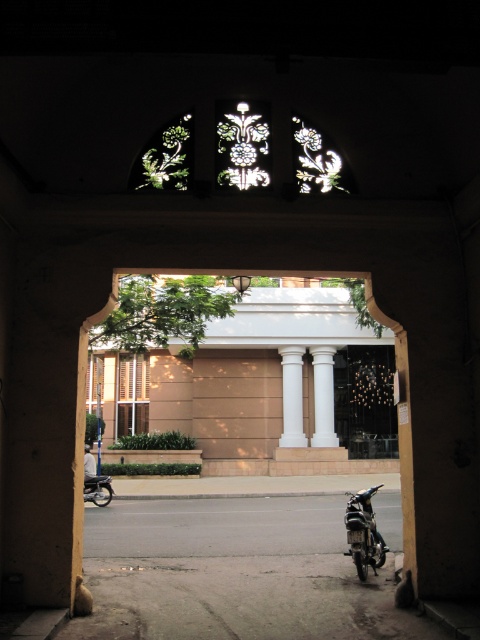
Question: Which point appears closest to the camera in this image?

Choices:
 (A) (104, 497)
 (B) (331, 403)

Answer: (A)

Question: Which object is positioned farthest from the shiny black motorcycle at lower left?

Choices:
 (A) white marble pillar at center
 (B) white smooth column at center
 (C) shiny black motorcycle at lower right

Answer: (A)

Question: Which is nearer to the white marble pillar at center?

Choices:
 (A) white smooth column at center
 (B) shiny black motorcycle at lower right

Answer: (A)

Question: Does shiny black motorcycle at lower right have a larger size compared to white marble pillar at center?

Choices:
 (A) yes
 (B) no

Answer: (A)

Question: Is white smooth column at center to the left of shiny black motorcycle at lower left from the viewer's perspective?

Choices:
 (A) yes
 (B) no

Answer: (B)

Question: Observing the image, what is the correct spatial positioning of white smooth column at center in reference to white marble pillar at center?

Choices:
 (A) above
 (B) below

Answer: (A)